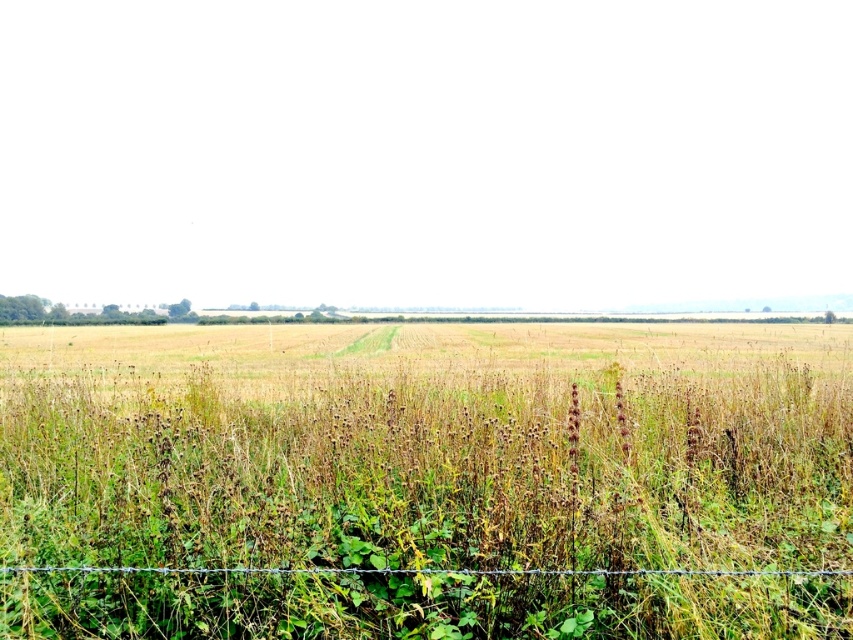
From the picture: Which of these two, green grass at center or wire at bottom, stands shorter?

With less height is wire at bottom.

Find the location of a particular element. green grass at center is located at coordinates (427, 445).

Measure the distance between point (553, 342) and camera.

The distance of point (553, 342) from camera is 33.28 meters.

What are the coordinates of `green grass at center` in the screenshot? It's located at (427, 445).